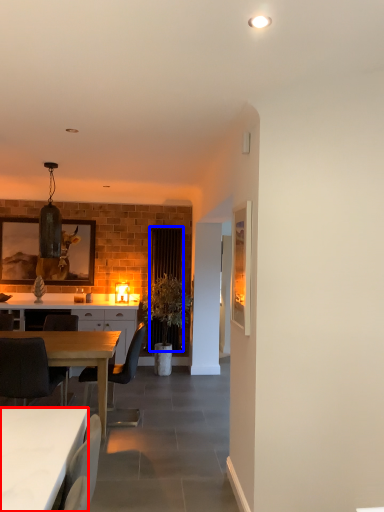
Question: Which point is further to the camera, desk (highlighted by a red box) or curtain (highlighted by a blue box)?

Choices:
 (A) desk
 (B) curtain

Answer: (B)